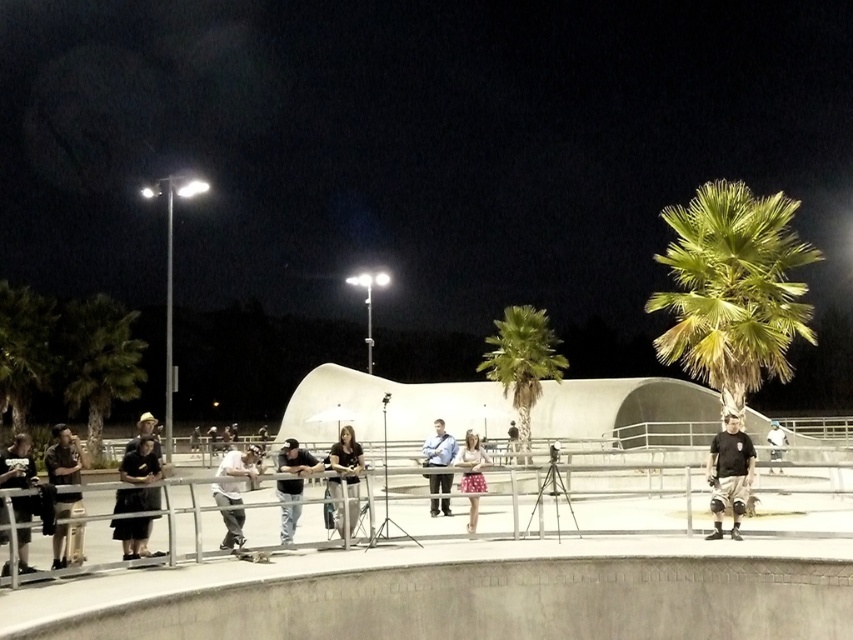
Question: Which object is positioned closest to the light pink fabric skirt at center?

Choices:
 (A) green leafy palm tree at center
 (B) black matte shirt at lower right

Answer: (B)

Question: Does black matte shirt at lower right have a greater width compared to light pink fabric skirt at center?

Choices:
 (A) yes
 (B) no

Answer: (A)

Question: Is light brown leather jacket at center to the right of dark gray jeans at center from the viewer's perspective?

Choices:
 (A) no
 (B) yes

Answer: (B)

Question: Is green leafy palm tree at center wider than black matte skateboard at center?

Choices:
 (A) yes
 (B) no

Answer: (A)

Question: Which point is farther to the camera?

Choices:
 (A) (254, 554)
 (B) (225, 474)

Answer: (B)

Question: Which is farther from the green leafy palm tree at left?

Choices:
 (A) matte black jacket at lower left
 (B) black matte shirt at lower right
 (C) white cotton t-shirt at center

Answer: (B)